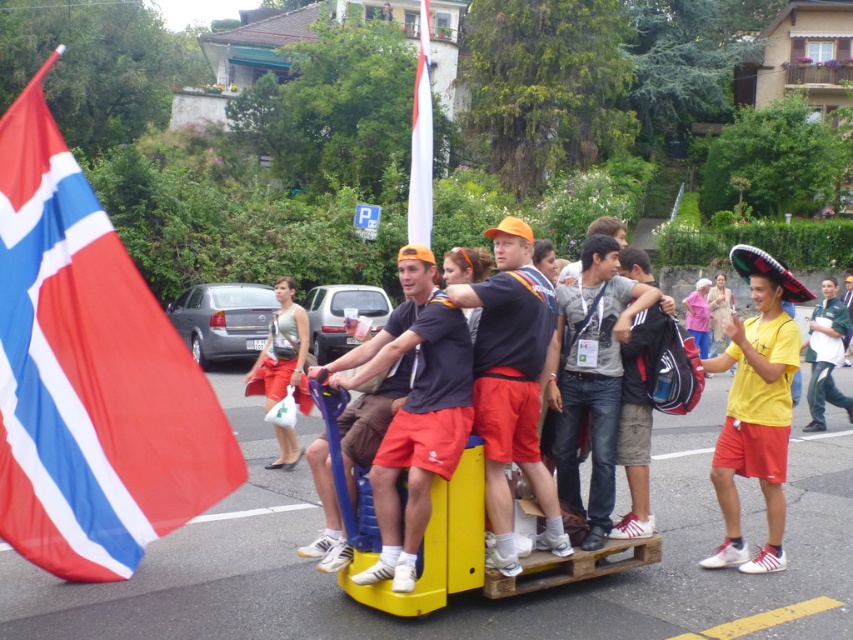
You are standing in the street scene and want to take a photo of the red fabric flag at left. If your camera can focus on objects up to 5 meters away, will you need to move closer to take a clear photo?

The red fabric flag at left is 5.32 meters from the viewer. Since the camera can focus up to 5 meters, you need to move closer to ensure the red fabric flag at left is within the 5 meter range for a clear photo.

You are standing at the point labeled point (x=28, y=557) and want to walk to the point labeled point (x=625, y=269). Which direction should you move in to get closer to your destination?

To move from point (x=28, y=557) to point (x=625, y=269), you should move upwards and to the left since point (x=625, y=269) is further away from the viewer compared to point (x=28, y=557).